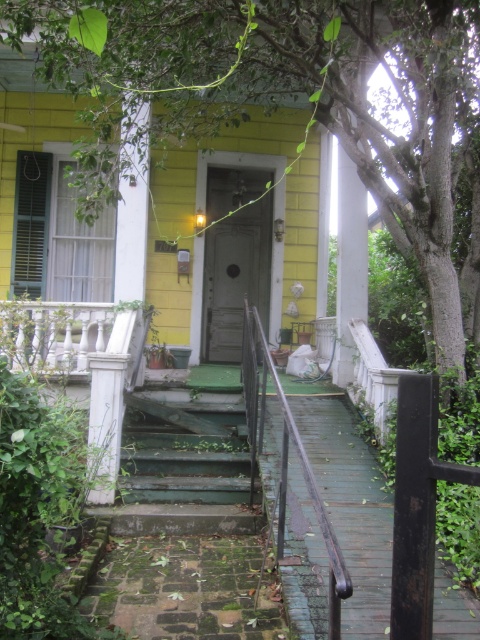
Does green painted wood porch at center have a smaller size compared to green weathered wood stairs at center?

Correct, green painted wood porch at center occupies less space than green weathered wood stairs at center.

Locate an element on the screen. This screenshot has height=640, width=480. green painted wood porch at center is located at coordinates (417, 502).

Who is higher up, green painted wood porch at center or white marble balustrade at left?

white marble balustrade at left is above.

Which is behind, point (406, 477) or point (29, 364)?

The point (29, 364) is behind.

Who is more forward, (423, 538) or (107, 339)?

Positioned in front is point (423, 538).

At what (x,y) coordinates should I click in order to perform the action: click on green painted wood porch at center. Please return your answer as a coordinate pair (x, y). This screenshot has width=480, height=640. Looking at the image, I should click on (417, 502).

Can you confirm if green painted wood porch at center is thinner than rusty metal railing at lower right?

No.

Looking at this image, who is more distant from viewer, (x=9, y=358) or (x=252, y=396)?

Point (x=9, y=358)

Where is `green painted wood porch at center`? The height and width of the screenshot is (640, 480). green painted wood porch at center is located at coordinates (417, 502).